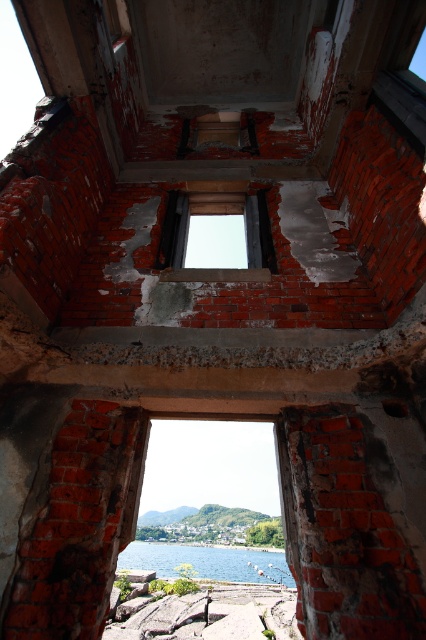
Question: Can you confirm if brick textured window frame at center is positioned below blue water at lower center?

Choices:
 (A) yes
 (B) no

Answer: (A)

Question: Does transparent glass window at center appear on the left side of blue water at lower center?

Choices:
 (A) yes
 (B) no

Answer: (A)

Question: Which point is closer to the camera?

Choices:
 (A) (253, 221)
 (B) (195, 548)

Answer: (A)

Question: Based on their relative distances, which object is farther from the transparent glass window at center?

Choices:
 (A) brick textured window frame at center
 (B) blue water at lower center

Answer: (A)

Question: Does brick textured window frame at center come in front of transparent glass window at center?

Choices:
 (A) yes
 (B) no

Answer: (A)

Question: Which of the following is the farthest from the observer?

Choices:
 (A) (172, 250)
 (B) (229, 428)

Answer: (B)